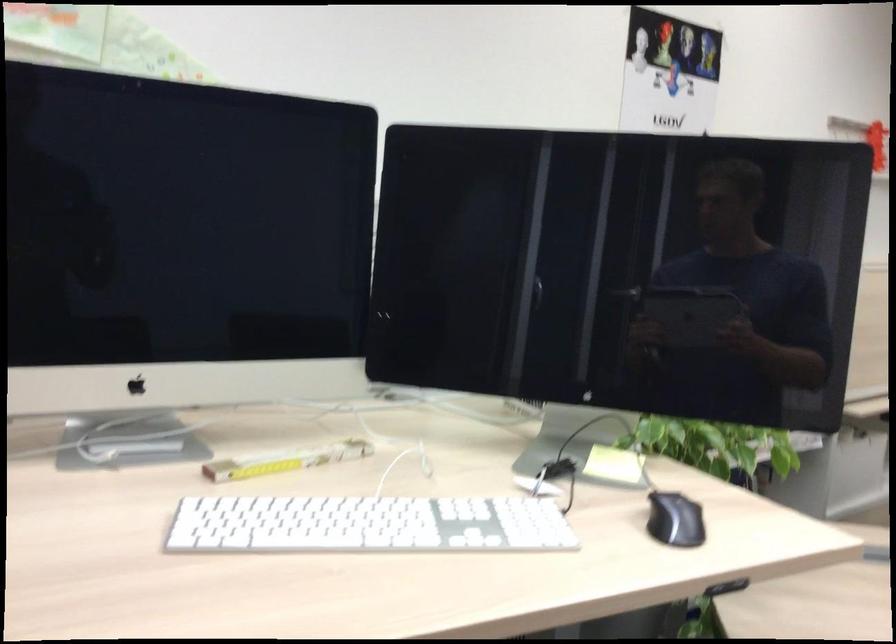
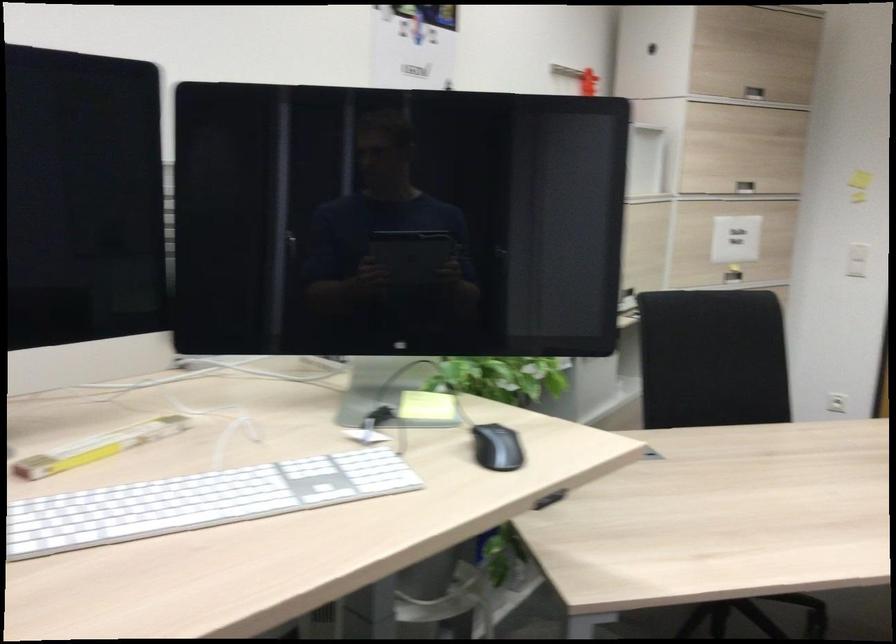
In the second image, find the point that corresponds to (x=280, y=458) in the first image.

(98, 447)